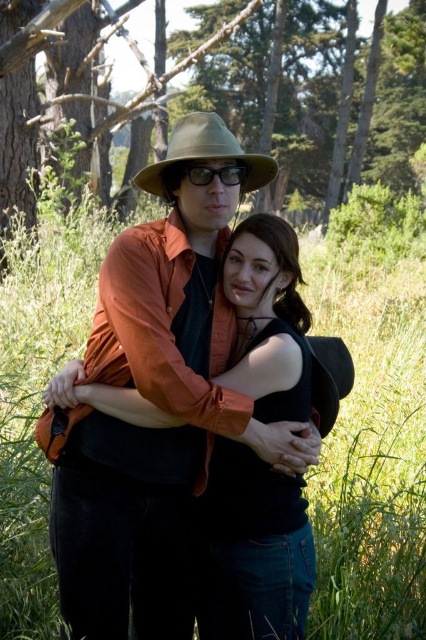
You are planning to place a small picnic basket on the green grass at center. Considering the brown wood tree at upper center is nearby, will there be enough space for the basket without being under the tree?

The green grass at center has a lesser width compared to the brown wood tree at upper center, so there might not be enough space for the picnic basket without it being under the tree.

You are a photographer trying to capture a closeup of the matte black goggles at center while also including the green grass at center in the frame. Which object should you focus on first to ensure both are in the shot?

The green grass at center is positioned on the right side of matte black goggles at center. Since the green grass is to the right of the goggles, you should focus on the matte black goggles at center first to ensure both are in the frame.

You are a hiker who wants to place the matte black goggles at center on the green grass at center. Will the goggles be fully visible if you do so?

The green grass at center has a greater height compared to matte black goggles at center. Therefore, placing the matte black goggles at center on the green grass at center may cause some parts of the goggles to be obscured by the grass.